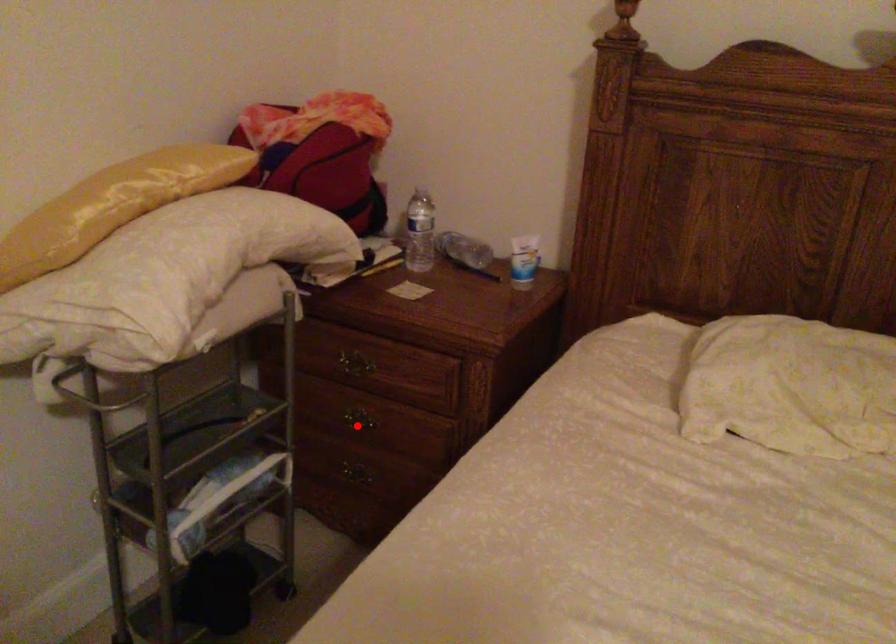
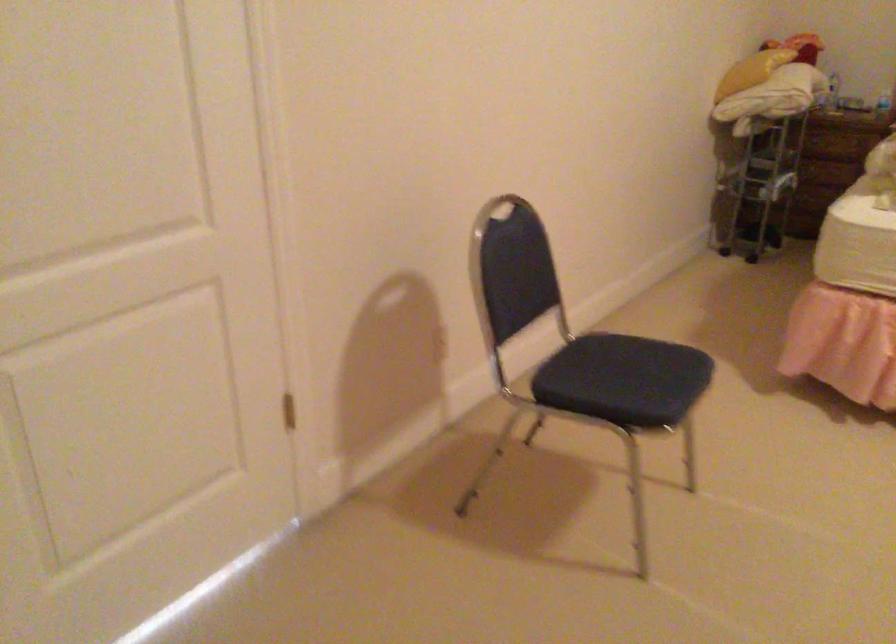
Question: I am providing you with two images of the same scene from different viewpoints. A red point is marked on the first image. Is the red point's position out of view in image 2?

Choices:
 (A) Yes
 (B) No

Answer: (A)